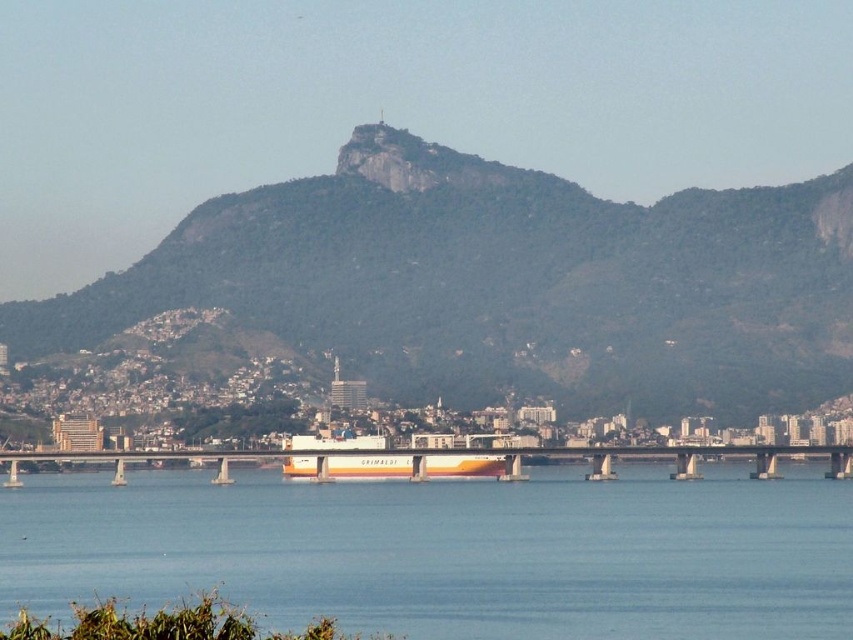
Who is positioned more to the left, yellow-orange concrete bridge at center or orange matte container ship at center?

orange matte container ship at center is more to the left.

Does yellow-orange concrete bridge at center lie behind orange matte container ship at center?

Yes, it is behind orange matte container ship at center.

Is point (326, 472) closer to camera compared to point (332, 460)?

No, (326, 472) is behind (332, 460).

Identify the location of yellow-orange concrete bridge at center. [x=461, y=452].

Which is more to the right, green rocky mountain at upper center or orange matte container ship at center?

green rocky mountain at upper center

Find the location of a particular element. green rocky mountain at upper center is located at coordinates (505, 284).

Between green rocky mountain at upper center and transparent water at lower center, which one has less height?

Standing shorter between the two is transparent water at lower center.

Does green rocky mountain at upper center appear over transparent water at lower center?

Correct, green rocky mountain at upper center is located above transparent water at lower center.

Who is more distant from viewer, (105, 332) or (683, 632)?

Point (683, 632)

Identify the location of green rocky mountain at upper center. (505, 284).